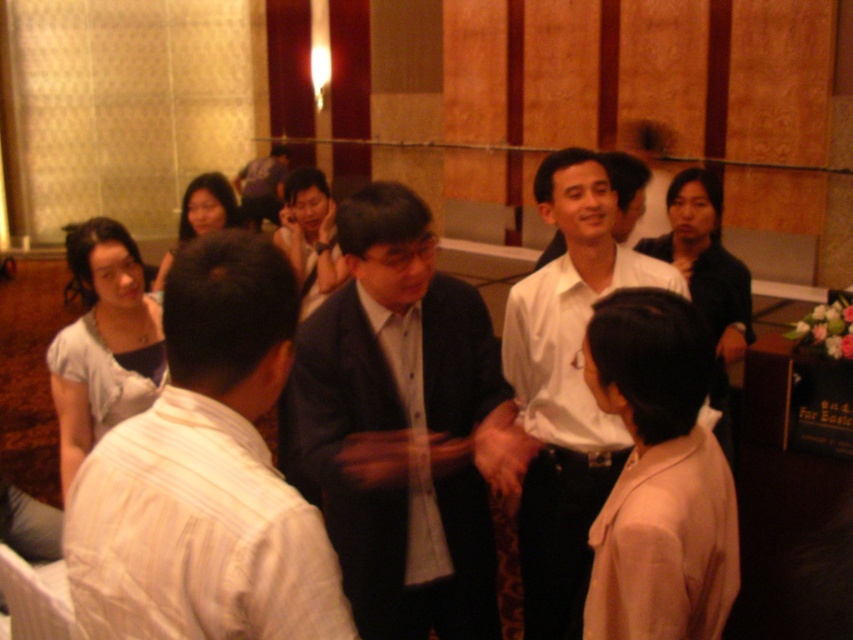
You are standing at the entrance of the room and see two points marked in the image. The first point is at coordinate point (672, 330) and the second is at point (682, 192). Which point is closer to you?

Point (672, 330) is in front of point (682, 192), so it is closer to you.

Consider the image. You are a photographer at an event and need to arrange two blouses for a photo shoot. The beige fabric blouse at center and the black silk blouse at upper right are available. Which blouse should be placed to the left if you want to mirror their current positions?

The beige fabric blouse at center should be placed to the left because in the current scene, it is already positioned on the left side of the black silk blouse at upper right, so mirroring would keep that left placement.